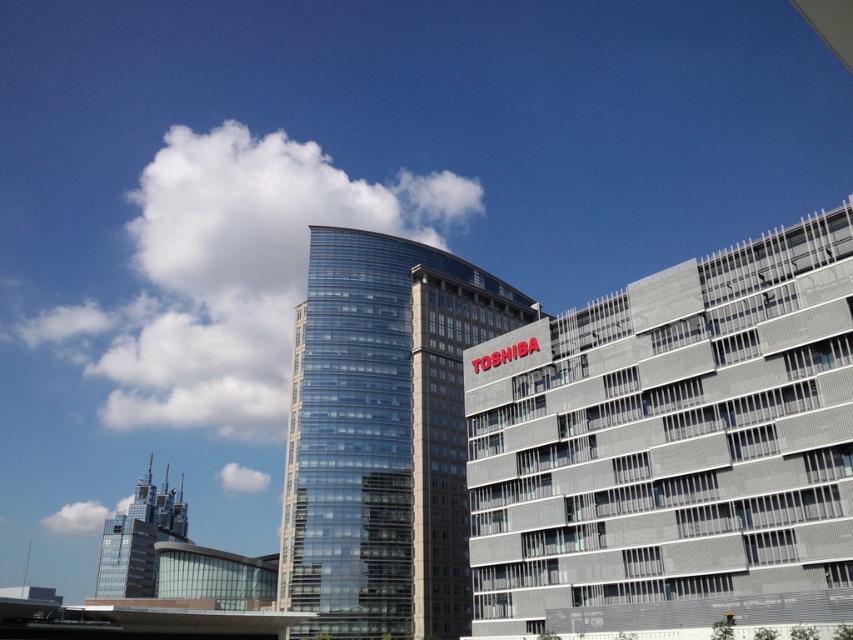
Question: Does transparent glass building at center appear under glassy skyscraper at left?

Choices:
 (A) no
 (B) yes

Answer: (A)

Question: Which point is farther to the camera?

Choices:
 (A) transparent glass building at center
 (B) gray metallic building at upper right

Answer: (A)

Question: Is transparent glass building at center to the left of glassy skyscraper at left from the viewer's perspective?

Choices:
 (A) no
 (B) yes

Answer: (A)

Question: Does transparent glass building at center appear on the left side of glassy skyscraper at left?

Choices:
 (A) no
 (B) yes

Answer: (A)

Question: Which point appears closest to the camera in this image?

Choices:
 (A) (340, 592)
 (B) (97, 593)

Answer: (A)

Question: Among these points, which one is nearest to the camera?

Choices:
 (A) (401, 528)
 (B) (105, 529)

Answer: (A)